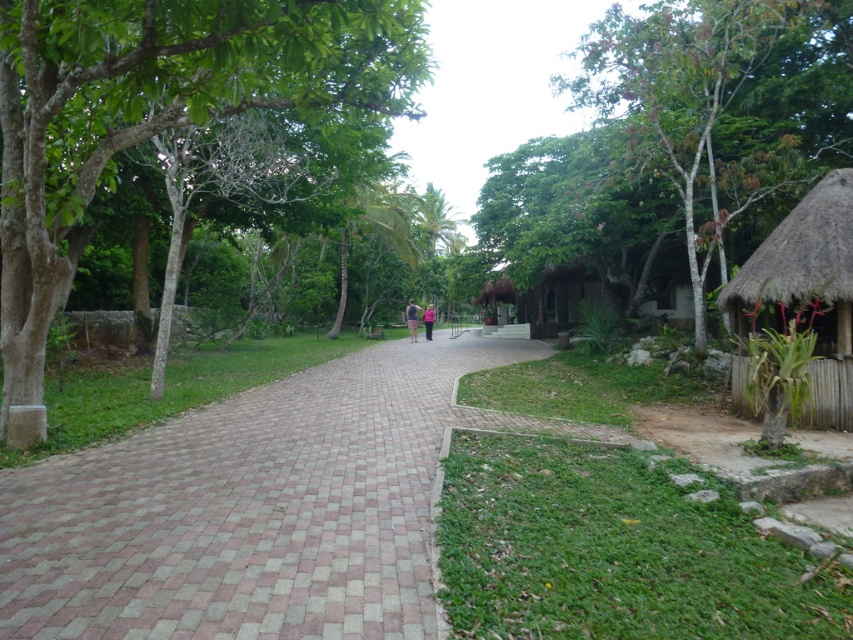
Does brick paved path at center appear on the left side of green leafy tree at upper right?

Yes, brick paved path at center is to the left of green leafy tree at upper right.

Can you confirm if brick paved path at center is taller than green leafy tree at upper right?

In fact, brick paved path at center may be shorter than green leafy tree at upper right.

Is point (251, 608) farther from viewer compared to point (666, 97)?

No, it is in front of (666, 97).

What are the coordinates of `brick paved path at center` in the screenshot? It's located at (248, 509).

Is brick paved path at center shorter than thatched bamboo hut at right?

Yes, brick paved path at center is shorter than thatched bamboo hut at right.

Which is below, brick paved path at center or thatched bamboo hut at right?

Positioned lower is brick paved path at center.

Who is more distant from viewer, (76,472) or (764,273)?

Point (764,273)

I want to click on brick paved path at center, so click(248, 509).

From the picture: Who is positioned more to the left, brick paved path at center or green leafy tree at left?

From the viewer's perspective, green leafy tree at left appears more on the left side.

Can you confirm if brick paved path at center is taller than green leafy tree at left?

In fact, brick paved path at center may be shorter than green leafy tree at left.

Image resolution: width=853 pixels, height=640 pixels. I want to click on brick paved path at center, so click(248, 509).